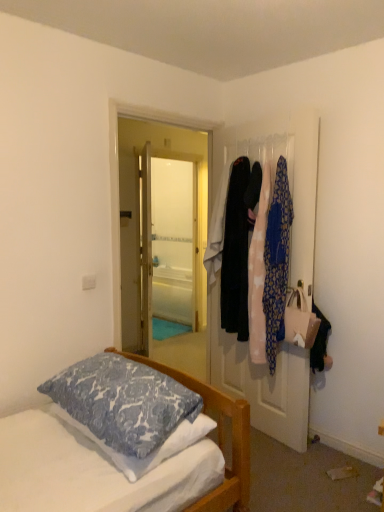
Question: Visually, is patterned fabric clothesline at upper right positioned to the left or to the right of blue printed pillow at lower left?

Choices:
 (A) right
 (B) left

Answer: (A)

Question: Looking at the image, does patterned fabric clothesline at upper right seem bigger or smaller compared to blue printed pillow at lower left?

Choices:
 (A) big
 (B) small

Answer: (B)

Question: Which object is positioned closest to the black velvet coat at right, which ranks as the 3th clothing in right-to-left order?

Choices:
 (A) white glossy door at center
 (B) patterned fabric clothesline at upper right
 (C) blue patterned fabric at right, positioned as the 3th clothing in left-to-right order
 (D) light pink fabric dress at right, the 2th clothing when ordered from right to left
 (E) blue printed pillow at lower left

Answer: (D)

Question: Estimate the real-world distances between objects in this image. Which object is closer to the blue printed pillow at lower left?

Choices:
 (A) light pink fabric dress at right, the 2th clothing when ordered from right to left
 (B) white glossy door at center
 (C) patterned fabric clothesline at upper right
 (D) black velvet coat at right, the first clothing in the left-to-right sequence
 (E) blue patterned fabric at right, positioned as the 3th clothing in left-to-right order

Answer: (A)